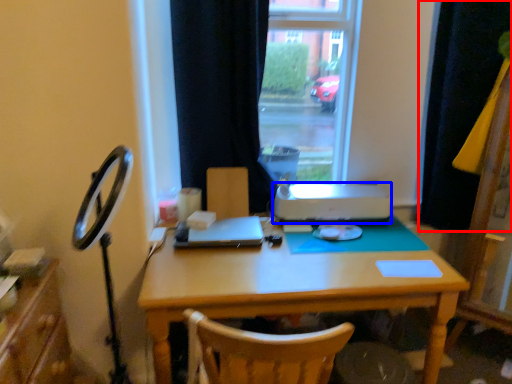
Question: Which point is closer to the camera, curtain (highlighted by a red box) or printer (highlighted by a blue box)?

Choices:
 (A) curtain
 (B) printer

Answer: (A)